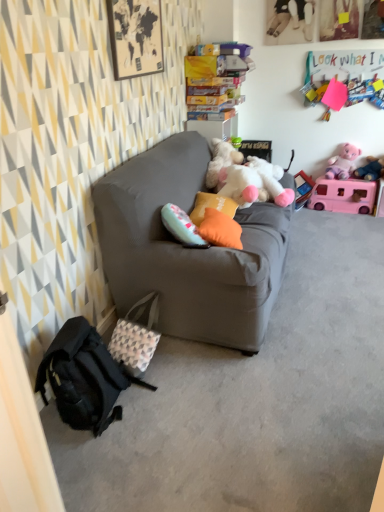
You are a GUI agent. You are given a task and a screenshot of the screen. Output one action in this format:
    pyautogui.click(x=<x>, y=<y>)
    Task: Click on the vacant area that is situated to the right of patterned fabric bag at lower left
    The width and height of the screenshot is (384, 512).
    Given the screenshot: What is the action you would take?
    pyautogui.click(x=186, y=364)